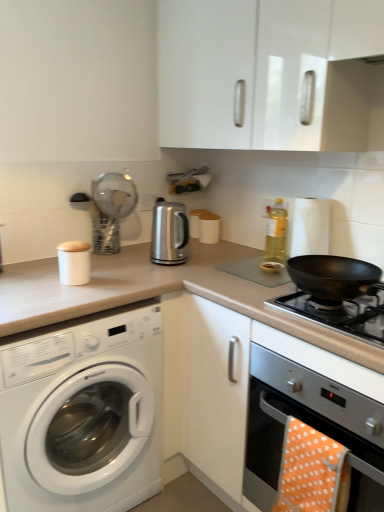
In order to click on free location to the left of satin silver kettle at center, arranged as the third appliance when viewed from the left in this screenshot , I will do `click(135, 262)`.